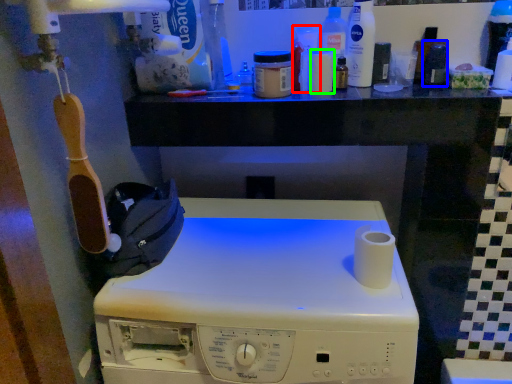
Question: Which object is positioned closest to toiletry (highlighted by a red box)? Select from toiletry (highlighted by a blue box) and toiletry (highlighted by a green box).

Choices:
 (A) toiletry
 (B) toiletry

Answer: (B)